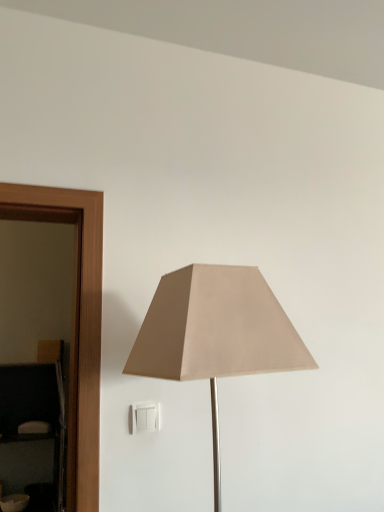
What is the approximate height of white plastic/light switch at lower center?

The height of white plastic/light switch at lower center is 9.57 centimeters.

This screenshot has height=512, width=384. What do you see at coordinates (38, 417) in the screenshot?
I see `matte black dresser at left` at bounding box center [38, 417].

This screenshot has height=512, width=384. What do you see at coordinates (215, 334) in the screenshot? I see `beige fabric lamp at center` at bounding box center [215, 334].

Locate an element on the screen. The image size is (384, 512). beige fabric lamp at center is located at coordinates (215, 334).

You are a GUI agent. You are given a task and a screenshot of the screen. Output one action in this format:
    pyautogui.click(x=<x>, y=<y>)
    Task: Click on the white plastic/light switch at lower center
    
    Given the screenshot: What is the action you would take?
    pyautogui.click(x=145, y=417)

Identify the location of light switch positioned vertically above the matte black dresser at left (from a real-world perspective). Image resolution: width=384 pixels, height=512 pixels. (145, 417).

Between white plastic/light switch at lower center and matte black dresser at left, which one has larger width?

With larger width is matte black dresser at left.

Who is more distant, white plastic/light switch at lower center or matte black dresser at left?

matte black dresser at left is further from the camera.

Could white plastic/light switch at lower center be considered to be inside matte black dresser at left?

Actually, white plastic/light switch at lower center is outside matte black dresser at left.

Is matte black dresser at left bigger than white plastic/light switch at lower center?

Yes.

From the image's perspective, which one is positioned higher, matte black dresser at left or white plastic/light switch at lower center?

white plastic/light switch at lower center appears higher in the image.

From their relative heights in the image, would you say matte black dresser at left is taller or shorter than white plastic/light switch at lower center?

Considering their sizes, matte black dresser at left has more height than white plastic/light switch at lower center.

Is matte black dresser at left next to beige fabric lamp at center and touching it?

No, matte black dresser at left is not making contact with beige fabric lamp at center.

In the scene shown: Which point is more distant from viewer, (54, 377) or (144, 320)?

The point (54, 377) is farther from the camera.

Does matte black dresser at left turn towards beige fabric lamp at center?

No.

Do you think matte black dresser at left is within beige fabric lamp at center, or outside of it?

matte black dresser at left is located beyond the bounds of beige fabric lamp at center.

Which of these two, beige fabric lamp at center or matte black dresser at left, stands taller?

matte black dresser at left.

Based on the photo, which is in front, beige fabric lamp at center or matte black dresser at left?

beige fabric lamp at center is in front.

Is beige fabric lamp at center to the left of matte black dresser at left from the viewer's perspective?

Incorrect, beige fabric lamp at center is not on the left side of matte black dresser at left.

From the image's perspective, which one is positioned lower, beige fabric lamp at center or matte black dresser at left?

From the image's view, matte black dresser at left is below.

Does white plastic/light switch at lower center turn towards beige fabric lamp at center?

Yes, white plastic/light switch at lower center is facing beige fabric lamp at center.

Considering the sizes of white plastic/light switch at lower center and beige fabric lamp at center in the image, is white plastic/light switch at lower center taller or shorter than beige fabric lamp at center?

Clearly, white plastic/light switch at lower center is shorter compared to beige fabric lamp at center.

How much distance is there between white plastic/light switch at lower center and beige fabric lamp at center?

They are 17.86 inches apart.

Which is more to the right, white plastic/light switch at lower center or beige fabric lamp at center?

From the viewer's perspective, beige fabric lamp at center appears more on the right side.

From the image's perspective, relative to white plastic/light switch at lower center, is beige fabric lamp at center above or below?

From the image's perspective, beige fabric lamp at center appears above white plastic/light switch at lower center.

In the scene shown: In the image, is beige fabric lamp at center positioned in front of or behind white plastic/light switch at lower center?

In the image, beige fabric lamp at center appears in front of white plastic/light switch at lower center.

Is beige fabric lamp at center beside white plastic/light switch at lower center?

beige fabric lamp at center and white plastic/light switch at lower center are not in contact.

From a real-world perspective, between beige fabric lamp at center and white plastic/light switch at lower center, who is vertically higher?

From a 3D spatial view, beige fabric lamp at center is above.

You are a GUI agent. You are given a task and a screenshot of the screen. Output one action in this format:
    pyautogui.click(x=<x>, y=<y>)
    Task: Click on the light switch in front of the matte black dresser at left
    The image size is (384, 512).
    Given the screenshot: What is the action you would take?
    pyautogui.click(x=145, y=417)

Find the location of a particular element. The height and width of the screenshot is (512, 384). dresser below the white plastic/light switch at lower center (from a real-world perspective) is located at coordinates (38, 417).

Based on their spatial positions, is white plastic/light switch at lower center or beige fabric lamp at center closer to matte black dresser at left?

Among the two, white plastic/light switch at lower center is located nearer to matte black dresser at left.

Which object lies nearer to the anchor point white plastic/light switch at lower center, matte black dresser at left or beige fabric lamp at center?

Based on the image, beige fabric lamp at center appears to be nearer to white plastic/light switch at lower center.

Estimate the real-world distances between objects in this image. Which object is closer to beige fabric lamp at center, matte black dresser at left or white plastic/light switch at lower center?

white plastic/light switch at lower center is closer to beige fabric lamp at center.

Estimate the real-world distances between objects in this image. Which object is further from matte black dresser at left, beige fabric lamp at center or white plastic/light switch at lower center?

Among the two, beige fabric lamp at center is located further to matte black dresser at left.

Considering their positions, is white plastic/light switch at lower center positioned closer to beige fabric lamp at center than matte black dresser at left?

white plastic/light switch at lower center is closer to beige fabric lamp at center.

Based on their spatial positions, is beige fabric lamp at center or matte black dresser at left further from white plastic/light switch at lower center?

Among the two, matte black dresser at left is located further to white plastic/light switch at lower center.

Where is `light switch between beige fabric lamp at center and matte black dresser at left along the z-axis`? light switch between beige fabric lamp at center and matte black dresser at left along the z-axis is located at coordinates (145, 417).